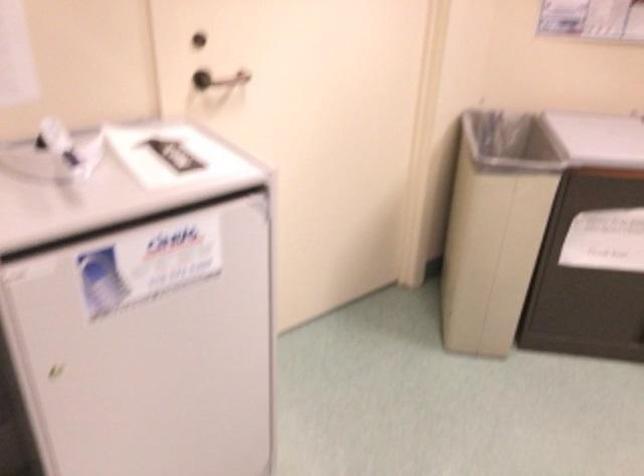
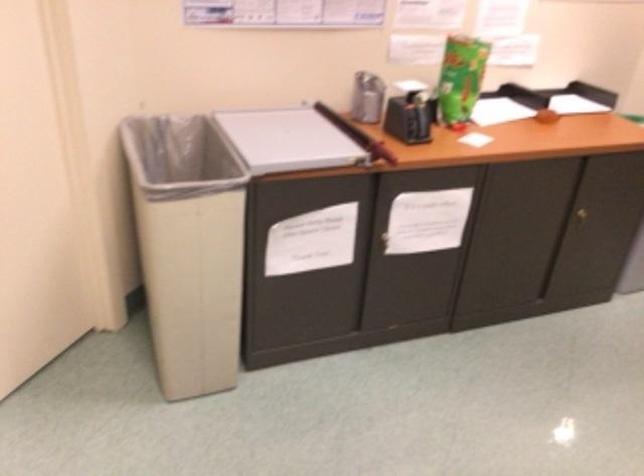
In a continuous first-person perspective shot, in which direction is the camera moving?

The cameraman walked toward right, forward.